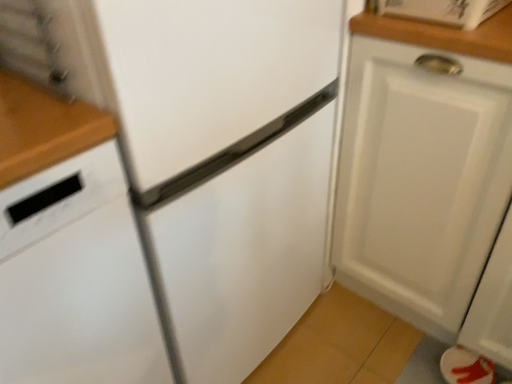
Question: Is white matte cabinet at right closer to the viewer compared to white matte dishwasher at left?

Choices:
 (A) yes
 (B) no

Answer: (B)

Question: Is white matte cabinet at right positioned beyond the bounds of white matte dishwasher at left?

Choices:
 (A) no
 (B) yes

Answer: (B)

Question: Can you confirm if white matte cabinet at right is taller than white matte dishwasher at left?

Choices:
 (A) yes
 (B) no

Answer: (B)

Question: Does white matte cabinet at right have a smaller size compared to white matte dishwasher at left?

Choices:
 (A) no
 (B) yes

Answer: (A)

Question: Does white matte cabinet at right have a lesser height compared to white matte dishwasher at left?

Choices:
 (A) yes
 (B) no

Answer: (A)

Question: Does white matte cabinet at right appear on the left side of white matte dishwasher at left?

Choices:
 (A) yes
 (B) no

Answer: (B)

Question: Is white matte cabinet at right at the back of white matte dishwasher at left?

Choices:
 (A) no
 (B) yes

Answer: (A)

Question: Could you tell me if white matte dishwasher at left is facing white matte cabinet at right?

Choices:
 (A) yes
 (B) no

Answer: (B)

Question: Is white matte dishwasher at left positioned beyond the bounds of white matte cabinet at right?

Choices:
 (A) no
 (B) yes

Answer: (B)

Question: Is white matte dishwasher at left wider than white matte cabinet at right?

Choices:
 (A) no
 (B) yes

Answer: (B)

Question: From the image's perspective, is white matte dishwasher at left located beneath white matte cabinet at right?

Choices:
 (A) no
 (B) yes

Answer: (B)

Question: Can you confirm if white matte dishwasher at left is shorter than white matte cabinet at right?

Choices:
 (A) no
 (B) yes

Answer: (A)

Question: In the image, is white matte dishwasher at left on the left side or the right side of white matte cabinet at right?

Choices:
 (A) right
 (B) left

Answer: (B)